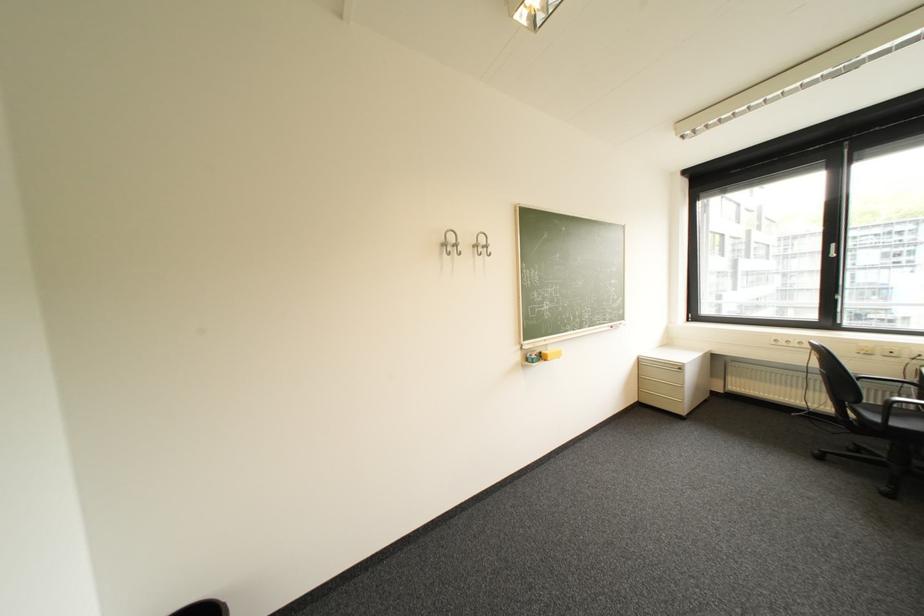
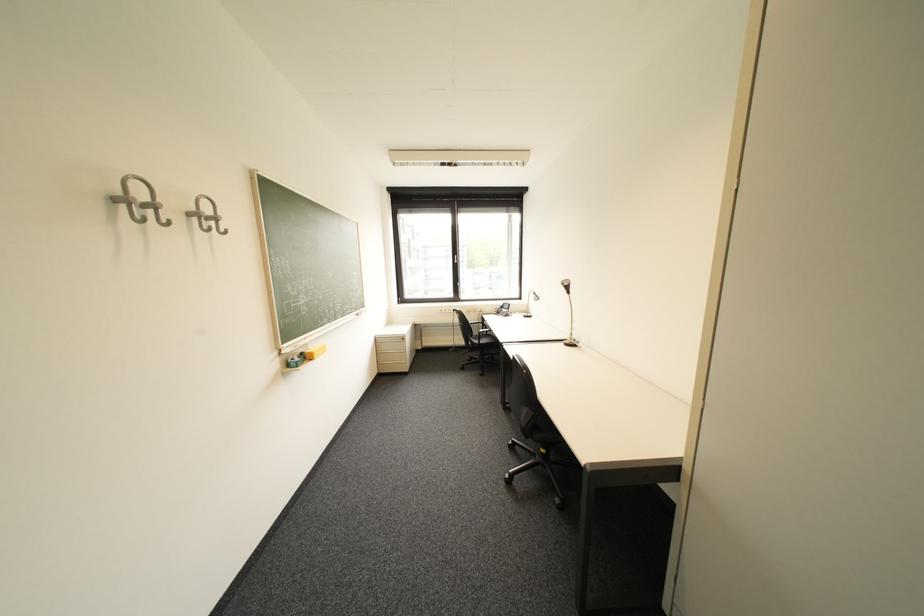
Locate, in the second image, the point that corresponds to [487,249] in the first image.

(205, 220)